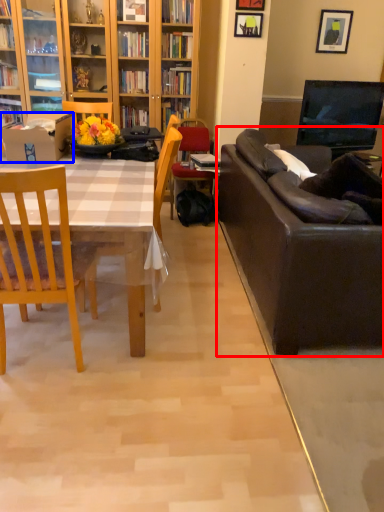
Question: Which point is further to the camera, studio couch (highlighted by a red box) or box (highlighted by a blue box)?

Choices:
 (A) studio couch
 (B) box

Answer: (B)